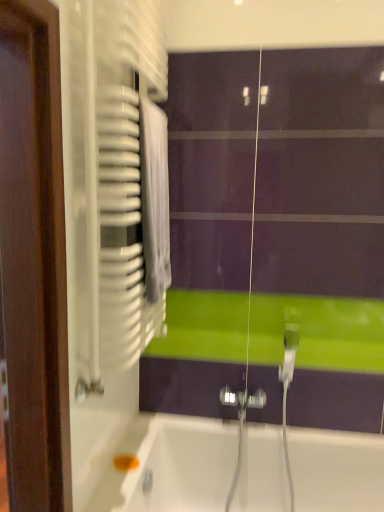
Describe the element at coordinates (106, 217) in the screenshot. I see `white plastic radiator at left` at that location.

Find the location of a particular element. The height and width of the screenshot is (512, 384). white plastic radiator at left is located at coordinates (106, 217).

This screenshot has width=384, height=512. What do you see at coordinates (179, 463) in the screenshot?
I see `white glossy bathtub at lower center` at bounding box center [179, 463].

This screenshot has height=512, width=384. I want to click on white glossy bathtub at lower center, so click(179, 463).

Find the location of `white plastic radiator at left`. white plastic radiator at left is located at coordinates (106, 217).

Is white glossy bathtub at lower center to the left or to the right of white plastic radiator at left in the image?

From the image, it's evident that white glossy bathtub at lower center is to the right of white plastic radiator at left.

Which is in front, white glossy bathtub at lower center or white plastic radiator at left?

white plastic radiator at left is closer to the camera.

Does point (169, 483) come behind point (95, 29)?

Yes.

From the image's perspective, is white glossy bathtub at lower center over white plastic radiator at left?

No, from the image's perspective, white glossy bathtub at lower center is not on top of white plastic radiator at left.

From a real-world perspective, between white glossy bathtub at lower center and white plastic radiator at left, who is vertically higher?

From a 3D spatial view, white plastic radiator at left is above.

Does white glossy bathtub at lower center have a lesser width compared to white plastic radiator at left?

In fact, white glossy bathtub at lower center might be wider than white plastic radiator at left.

Is white glossy bathtub at lower center taller or shorter than white plastic radiator at left?

In the image, white glossy bathtub at lower center appears to be shorter than white plastic radiator at left.

Which of these two, white glossy bathtub at lower center or white plastic radiator at left, is bigger?

white glossy bathtub at lower center is bigger.

Is white glossy bathtub at lower center spatially inside white plastic radiator at left, or outside of it?

The correct answer is: outside.

Is white glossy bathtub at lower center directly adjacent to white plastic radiator at left?

No.

From the picture: Could you tell me if white glossy bathtub at lower center is turned towards white plastic radiator at left?

No, white glossy bathtub at lower center does not turn towards white plastic radiator at left.

What's the angular difference between white glossy bathtub at lower center and white plastic radiator at left's facing directions?

The angle between the facing direction of white glossy bathtub at lower center and the facing direction of white plastic radiator at left is 90 degrees.

At what (x,y) coordinates should I click in order to perform the action: click on bathtub that appears below the white plastic radiator at left (from a real-world perspective). Please return your answer as a coordinate pair (x, y). Looking at the image, I should click on (179, 463).

Which is more to the left, white plastic radiator at left or white glossy bathtub at lower center?

From the viewer's perspective, white plastic radiator at left appears more on the left side.

Which is behind, white plastic radiator at left or white glossy bathtub at lower center?

white glossy bathtub at lower center is more distant.

Which point is more forward, (122, 242) or (339, 472)?

The point (122, 242) is more forward.

From the image's perspective, is white plastic radiator at left located beneath white glossy bathtub at lower center?

Actually, white plastic radiator at left appears above white glossy bathtub at lower center in the image.

From a real-world perspective, relative to white glossy bathtub at lower center, is white plastic radiator at left vertically above or below?

Clearly, from a real-world perspective, white plastic radiator at left is above white glossy bathtub at lower center.

Between white plastic radiator at left and white glossy bathtub at lower center, which one has larger width?

With larger width is white glossy bathtub at lower center.

Who is shorter, white plastic radiator at left or white glossy bathtub at lower center?

white glossy bathtub at lower center.

Between white plastic radiator at left and white glossy bathtub at lower center, which one has smaller size?

Smaller between the two is white plastic radiator at left.

Is white plastic radiator at left inside or outside of white glossy bathtub at lower center?

white plastic radiator at left exists outside the volume of white glossy bathtub at lower center.

Is white plastic radiator at left positioned far away from white glossy bathtub at lower center?

white plastic radiator at left is near white glossy bathtub at lower center, not far away.

Is white plastic radiator at left turned away from white glossy bathtub at lower center?

white plastic radiator at left does not have its back to white glossy bathtub at lower center.

How distant is white plastic radiator at left from white glossy bathtub at lower center?

white plastic radiator at left and white glossy bathtub at lower center are 32.63 inches apart from each other.

The height and width of the screenshot is (512, 384). I want to click on bathtub beneath the white plastic radiator at left (from a real-world perspective), so pos(179,463).

Locate an element on the screen. This screenshot has height=512, width=384. bathtub below the white plastic radiator at left (from the image's perspective) is located at coordinates (179, 463).

You are a GUI agent. You are given a task and a screenshot of the screen. Output one action in this format:
    pyautogui.click(x=<x>, y=<y>)
    Task: Click on the screen door to the left of white glossy bathtub at lower center
    
    Given the screenshot: What is the action you would take?
    pyautogui.click(x=106, y=217)